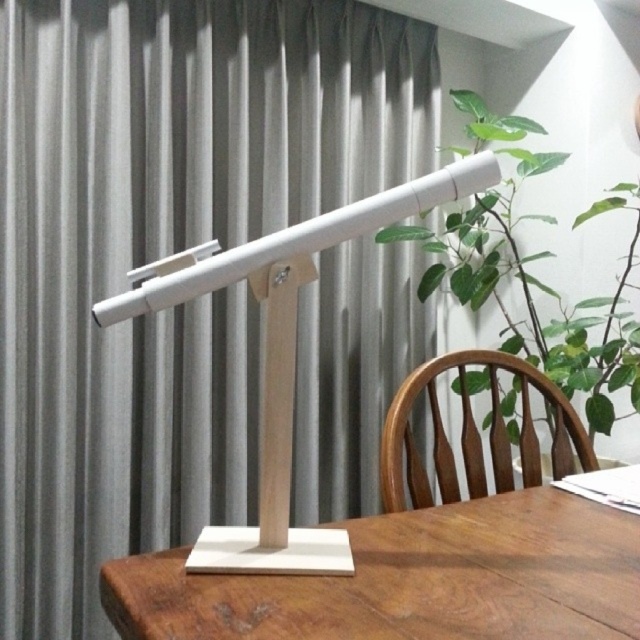
You are a visitor sitting in the brown wooden chair at center. You want to see the view outside the window but the green leafy plant at center is blocking your view. Can you see the window through the plant?

The green leafy plant at center is much taller than the brown wooden chair at center, so it is blocking your view of the window.

You are sitting on the brown wooden chair at center and want to reach the wooden table at center. Can you easily reach the table from your current position?

The wooden table at center is in front of the brown wooden chair at center, so you can easily reach the table from your current position.